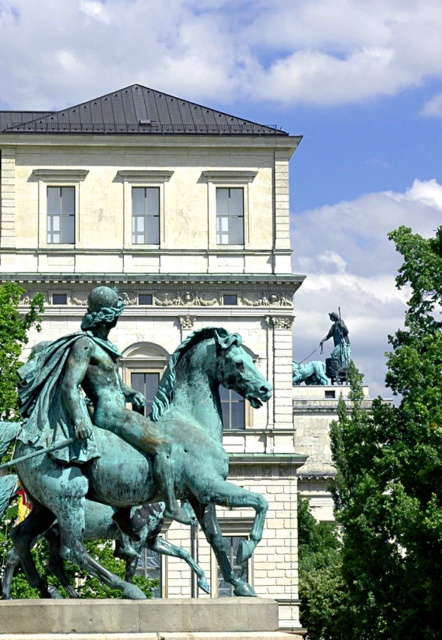
Question: Among these objects, which one is nearest to the camera?

Choices:
 (A) matte bronze palace at center
 (B) green patina horse at center

Answer: (B)

Question: Which of these objects is positioned farthest from the matte bronze palace at center?

Choices:
 (A) green patina horse at center
 (B) bronze statue at center

Answer: (B)

Question: Which point appears closest to the camera in this image?

Choices:
 (A) (342, 349)
 (B) (176, 496)

Answer: (B)

Question: Can you confirm if matte bronze palace at center is thinner than green patina horse at center?

Choices:
 (A) yes
 (B) no

Answer: (B)

Question: Where is matte bronze palace at center located in relation to green patina horse at center in the image?

Choices:
 (A) above
 (B) below

Answer: (A)

Question: Can you confirm if green patina horse at center is bigger than bronze statue at center?

Choices:
 (A) yes
 (B) no

Answer: (B)